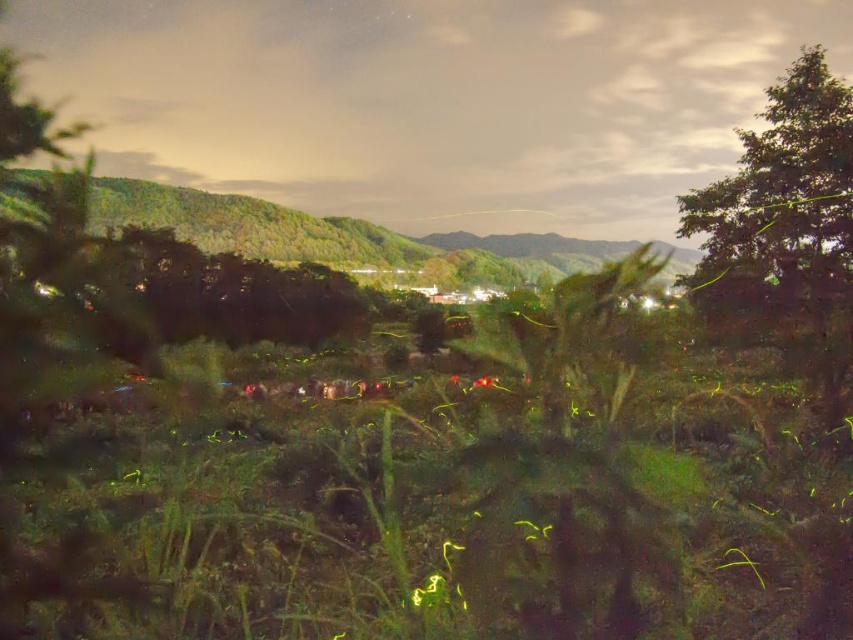
You are standing in the middle of the green grass at center and want to walk towards the green leafy hillside at upper left. Is the hillside behind or in front of you?

The green leafy hillside at upper left is behind you because the green grass at center is positioned over it, indicating that the hillside is farther away from your current position.

You are an artist planning to paint this landscape. You want to ensure the green leafy tree at upper right and the green leafy hillside at upper left are proportionally accurate. Which one should you make narrower in your painting?

The green leafy tree at upper right should be made narrower in the painting because its width is less than that of the green leafy hillside at upper left.

Looking at this image, based on the scene described, which object, the green leafy tree at upper right or the green leafy hillside at upper left, is closer to the horizon?

The green leafy hillside at upper left is closer to the horizon because it is taller than the green leafy tree at upper right, which appears smaller and thus farther away.